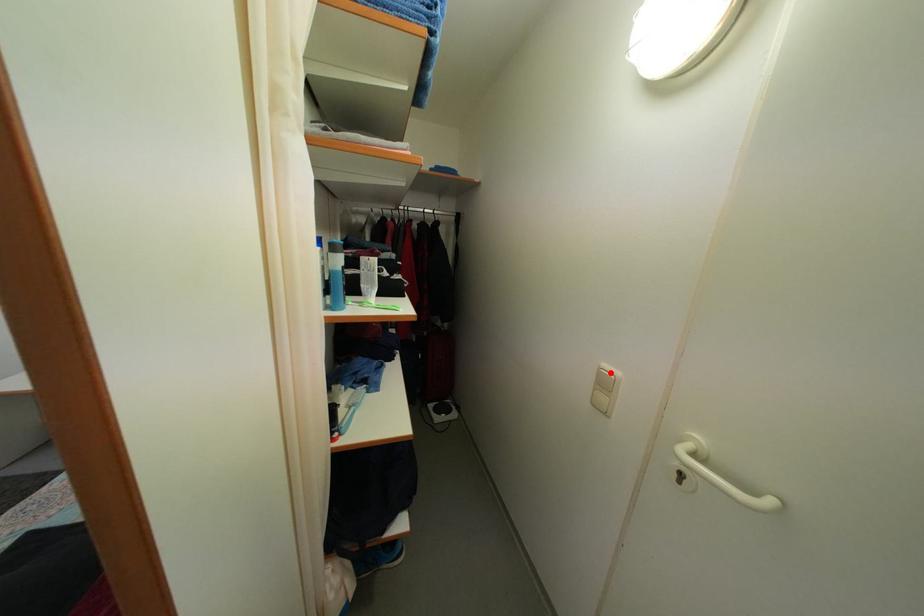
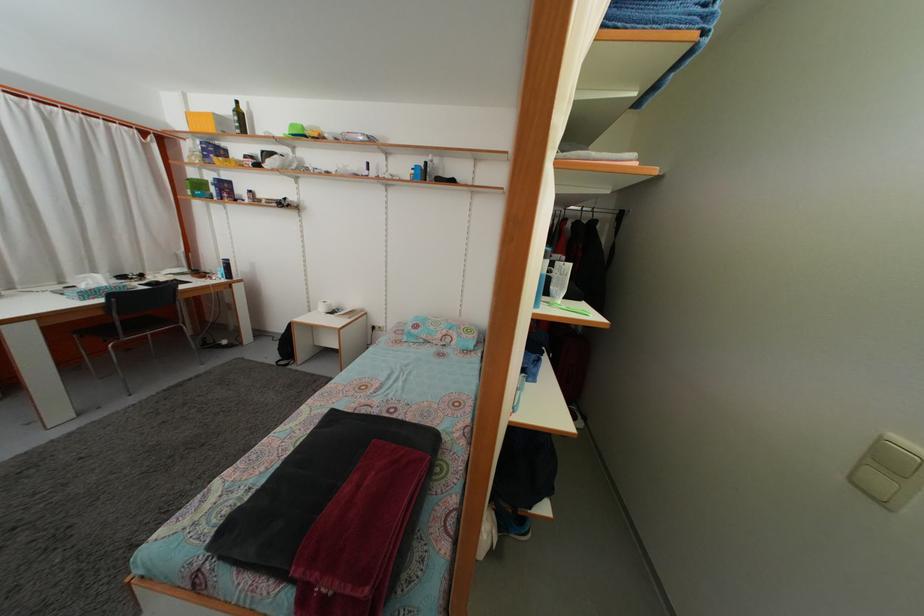
Question: I am providing you with two images of the same scene from different viewpoints. A red point is marked on the first image. At the location where the point appears in image 1, is it still visible in image 2?

Choices:
 (A) Yes
 (B) No

Answer: (A)